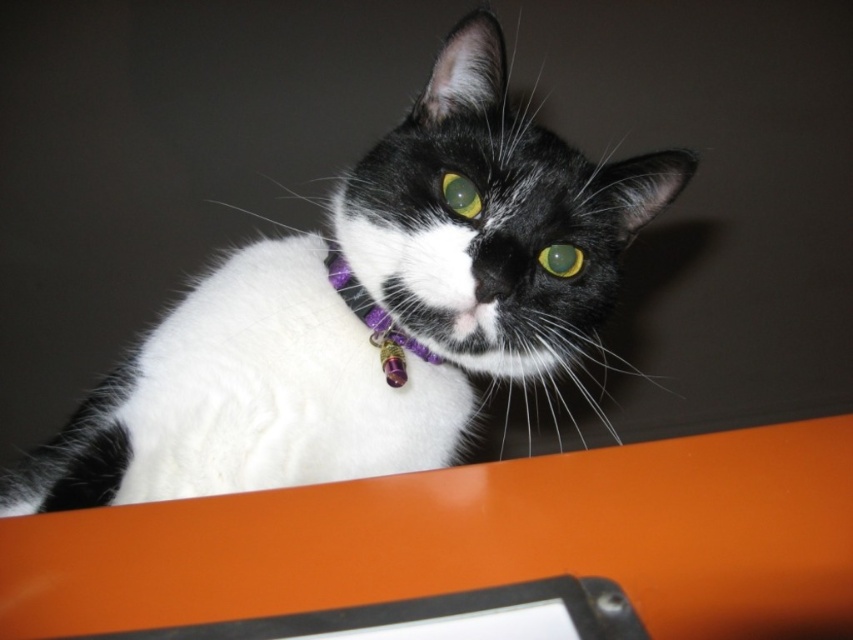
You are a photographer trying to capture the white fur cat at center and the purple fabric collar at center in a single frame. Based on their positions, will the collar appear above or below the cat in the photo?

The white fur cat at center is located below the purple fabric collar at center, so the collar will appear above the cat in the photo.

You are standing in front of the image and want to touch the two points mentioned. Which point is closer to you, point [358,384] or point [387,323]?

Point [358,384] is closer to the viewer than point [387,323].